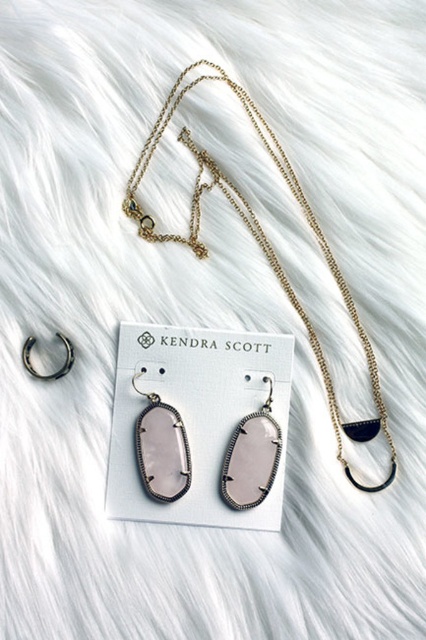
Does gold chain necklace at upper center have a lesser height compared to pink glass earring at center?

Incorrect, gold chain necklace at upper center's height does not fall short of pink glass earring at center's.

At what (x,y) coordinates should I click in order to perform the action: click on gold chain necklace at upper center. Please return your answer as a coordinate pair (x, y). This screenshot has width=426, height=640. Looking at the image, I should click on (259, 244).

Between point (305, 216) and point (259, 451), which one is positioned behind?

Point (305, 216)

Where is `gold chain necklace at upper center`? The image size is (426, 640). gold chain necklace at upper center is located at coordinates (259, 244).